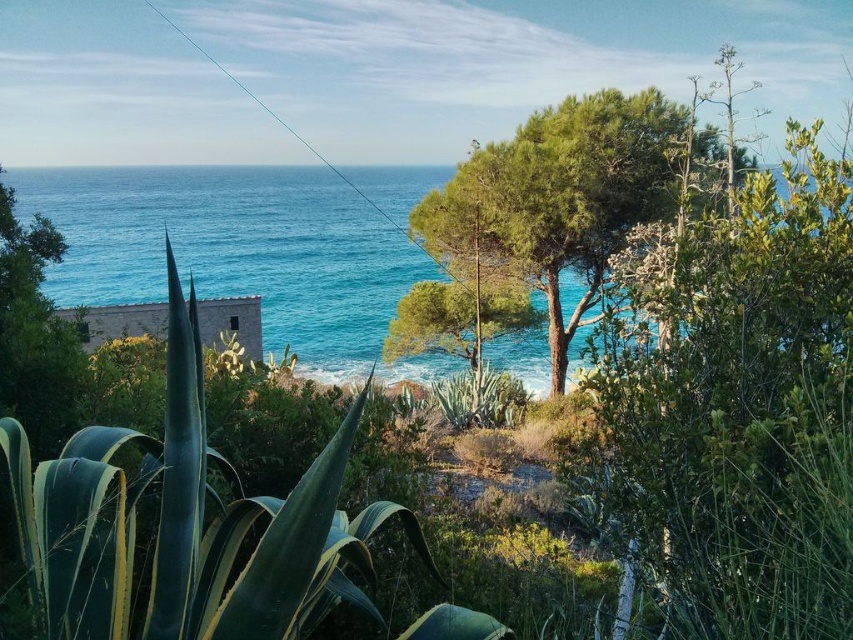
Based on the photo, you are a hiker standing in the coastal landscape and want to take a photo of both the green leafy tree at center and the green leafy tree at left. Which tree should you move closer to in order to include both in your camera frame?

To include both the green leafy tree at center and the green leafy tree at left in your camera frame, you should move closer to the green leafy tree at left. Since the green leafy tree at center is larger, moving closer to the smaller tree allows you to fit both within the frame by balancing their sizes.

You are an environmental scientist assessing the coastal area. You observe the blue water at left and the green leafy tree at left in the scene. Which of these two elements occupies a greater visual area in the image?

The blue water at left has a larger size compared to the green leafy tree at left, so the blue water at left occupies a greater visual area in the image.

You are standing at the center of the coastal landscape and want to walk to the blue water at left. There is a green leafy tree at left blocking your path. Can you walk around it to reach the water?

The blue water at left is 174.27 feet away from the green leafy tree at left, so you can walk around the green leafy tree at left to reach the blue water at left since there is enough space between them.